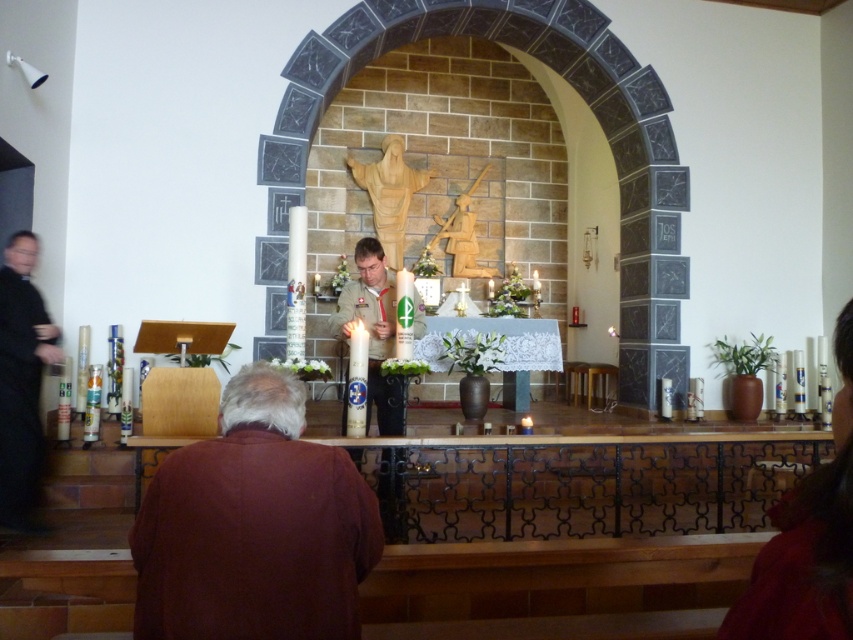
You are a photographer standing in the middle of the church. You want to take a photo that includes both the matte brown hair at lower right and the black clothed figure at left. Given that your camera has a maximum zoom range of 5 meters, will you be able to capture both subjects in the same frame without moving closer?

The matte brown hair at lower right and the black clothed figure at left are 3.73 meters apart. Since the camera can zoom up to 5 meters, which is greater than the distance between them, you can capture both subjects in the same frame without moving closer.

You are standing in front of the altar and notice two items of clothing. The brown cotton shirt at lower center and the matte brown hair at lower right. Which one is positioned more to the left side?

The brown cotton shirt at lower center is positioned to the left of the matte brown hair at lower right, so the brown cotton shirt at lower center is more to the left.